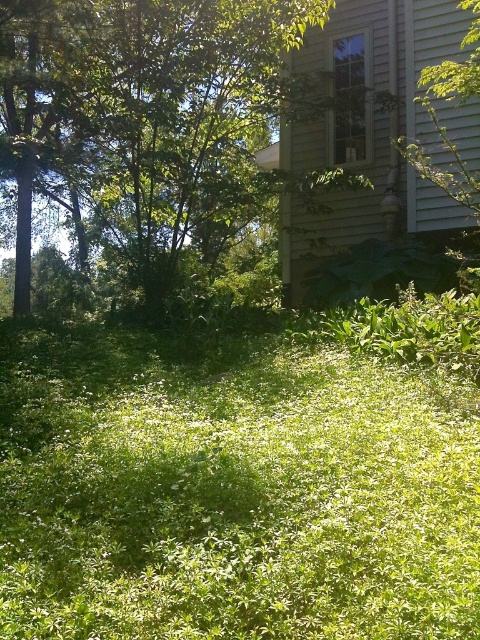
Where is `green leafy grass at center`? green leafy grass at center is located at coordinates (232, 493).

Find the location of a particular element. The image size is (480, 640). green leafy grass at center is located at coordinates (232, 493).

This screenshot has width=480, height=640. I want to click on green leafy grass at center, so click(x=232, y=493).